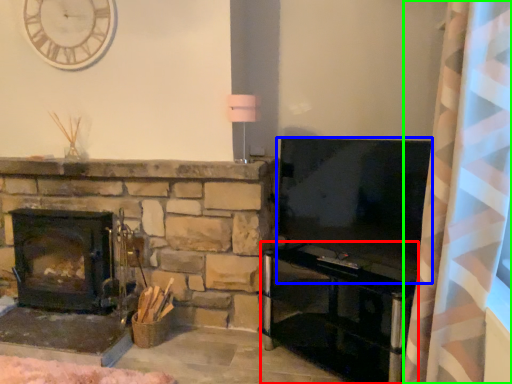
Question: Which is nearer to the entertainment center (highlighted by a red box)? television (highlighted by a blue box) or curtain (highlighted by a green box).

Choices:
 (A) television
 (B) curtain

Answer: (A)